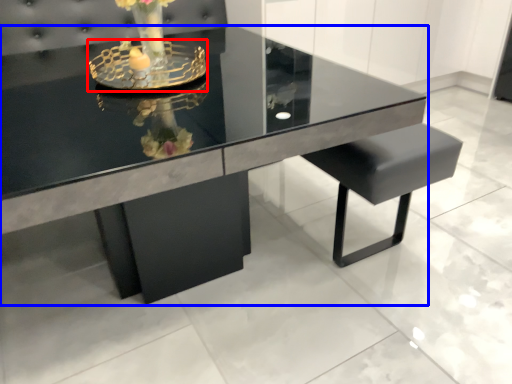
Question: Among these objects, which one is farthest to the camera, candle holder (highlighted by a red box) or table (highlighted by a blue box)?

Choices:
 (A) candle holder
 (B) table

Answer: (A)